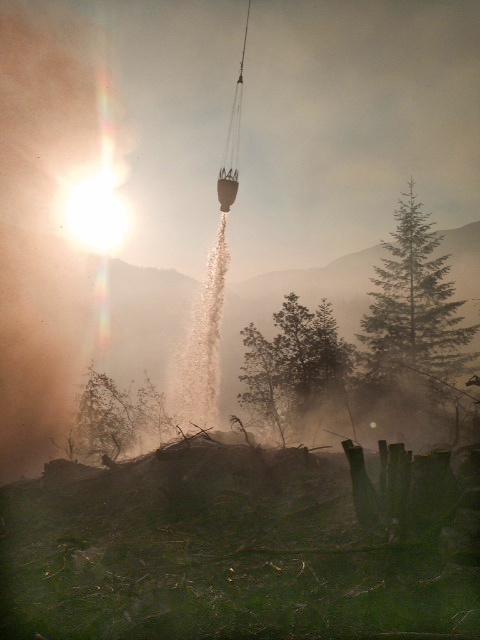
Can you confirm if green matte tree at center is thinner than translucent sand at center?

Yes.

Is green matte tree at center taller than translucent sand at center?

In fact, green matte tree at center may be shorter than translucent sand at center.

Locate an element on the screen. This screenshot has height=640, width=480. green matte tree at center is located at coordinates (294, 362).

Based on the photo, can you confirm if green textured pine tree at center right is bigger than translucent sand at center?

Yes, green textured pine tree at center right is bigger than translucent sand at center.

Is point (417, 348) closer to camera compared to point (211, 378)?

Yes.

Locate an element on the screen. The width and height of the screenshot is (480, 640). green textured pine tree at center right is located at coordinates (415, 310).

Does point (397, 301) come closer to viewer compared to point (314, 316)?

That is False.

Between green textured pine tree at center right and green matte tree at center, which one appears on the left side from the viewer's perspective?

Positioned to the left is green matte tree at center.

This screenshot has width=480, height=640. I want to click on green textured pine tree at center right, so click(415, 310).

Locate an element on the screen. Image resolution: width=480 pixels, height=640 pixels. green textured pine tree at center right is located at coordinates (415, 310).